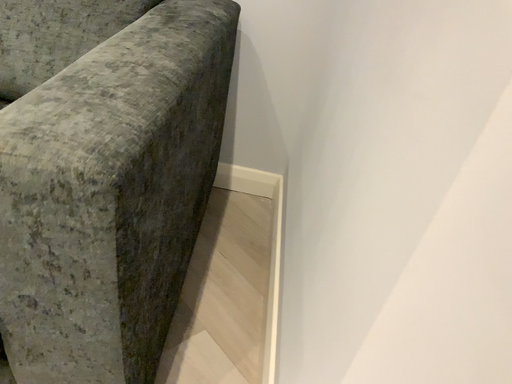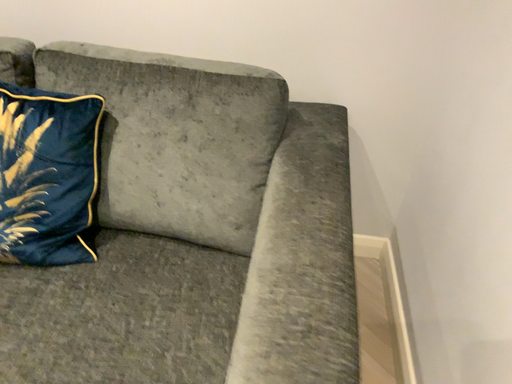
Question: How did the camera likely rotate when shooting the video?

Choices:
 (A) rotated right
 (B) rotated left

Answer: (B)